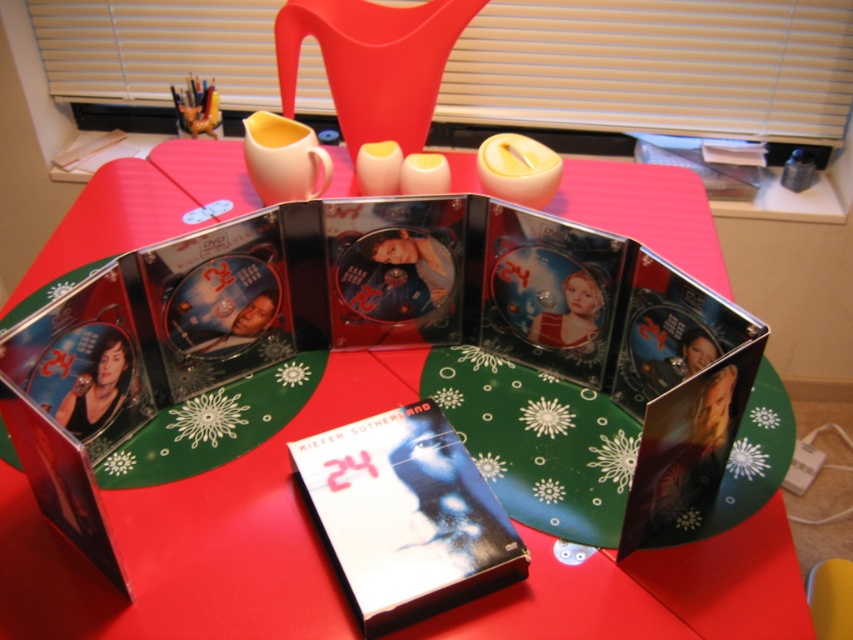
Can you confirm if red glossy table at center is taller than matte black dvd at center?

Correct, red glossy table at center is much taller as matte black dvd at center.

Can you confirm if red glossy table at center is positioned below matte black dvd at center?

Actually, red glossy table at center is above matte black dvd at center.

You are a GUI agent. You are given a task and a screenshot of the screen. Output one action in this format:
    pyautogui.click(x=<x>, y=<y>)
    Task: Click on the red glossy table at center
    This screenshot has height=640, width=853.
    Given the screenshot: What is the action you would take?
    pyautogui.click(x=199, y=538)